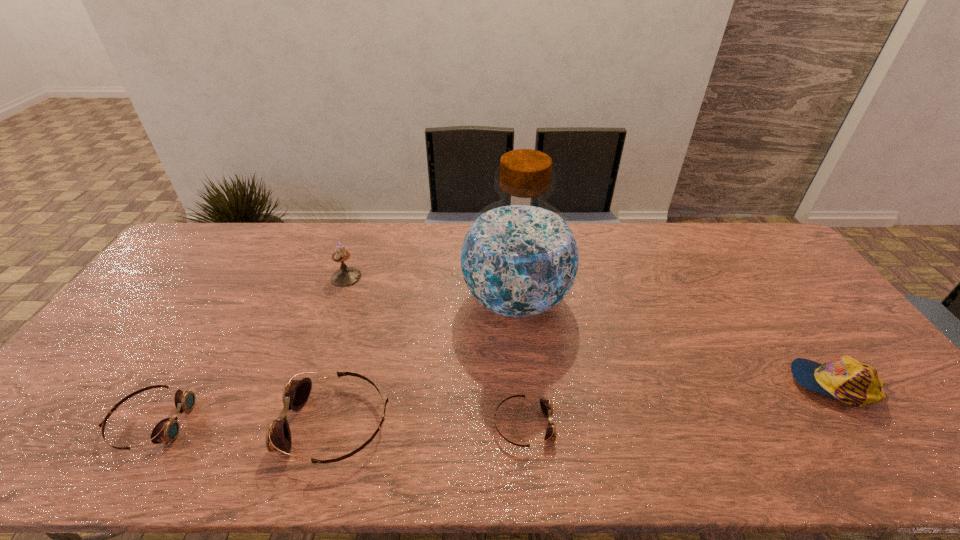
Identify the location of vacant space located through the lenses of the tallest goggles. (191, 423).

Where is `free spot located through the lenses of the tallest goggles`? The height and width of the screenshot is (540, 960). free spot located through the lenses of the tallest goggles is located at coordinates (161, 423).

Identify the location of vacant region located through the lenses of the shortest goggles. (667, 425).

Where is `blank area located on the front of the fifth shortest object`? This screenshot has height=540, width=960. blank area located on the front of the fifth shortest object is located at coordinates (335, 309).

Identify the location of free space located 0.300m on the right of the water jug. This screenshot has width=960, height=540. pyautogui.click(x=670, y=300).

Where is `vacant space located on the bill of the cap`? vacant space located on the bill of the cap is located at coordinates (660, 384).

Image resolution: width=960 pixels, height=540 pixels. I want to click on free region located 0.370m on the bill of the cap, so click(x=648, y=384).

Where is `free space located 0.170m on the bill of the cap`? free space located 0.170m on the bill of the cap is located at coordinates (726, 384).

This screenshot has height=540, width=960. I want to click on cap present at the near edge, so click(x=853, y=382).

Image resolution: width=960 pixels, height=540 pixels. Find the location of `object present at the right edge`. object present at the right edge is located at coordinates (853, 382).